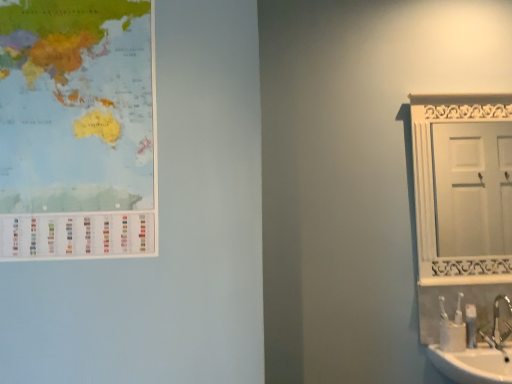
Question: Is matte paper map at upper left wider than white wooden door at right?

Choices:
 (A) no
 (B) yes

Answer: (A)

Question: Is the position of matte paper map at upper left less distant than that of white wooden door at right?

Choices:
 (A) no
 (B) yes

Answer: (B)

Question: From a real-world perspective, is matte paper map at upper left beneath white wooden door at right?

Choices:
 (A) yes
 (B) no

Answer: (B)

Question: Considering the relative sizes of matte paper map at upper left and white wooden door at right in the image provided, is matte paper map at upper left smaller than white wooden door at right?

Choices:
 (A) no
 (B) yes

Answer: (B)

Question: From the image's perspective, would you say matte paper map at upper left is shown under white wooden door at right?

Choices:
 (A) no
 (B) yes

Answer: (A)

Question: Is white wooden door at right at the back of matte paper map at upper left?

Choices:
 (A) yes
 (B) no

Answer: (B)

Question: Does silver metallic faucet at lower right have a greater width compared to white wooden door at right?

Choices:
 (A) no
 (B) yes

Answer: (B)

Question: Is silver metallic faucet at lower right turned away from white wooden door at right?

Choices:
 (A) no
 (B) yes

Answer: (A)

Question: Is silver metallic faucet at lower right in front of white wooden door at right?

Choices:
 (A) yes
 (B) no

Answer: (A)

Question: From the image's perspective, does silver metallic faucet at lower right appear lower than white wooden door at right?

Choices:
 (A) no
 (B) yes

Answer: (B)

Question: Is silver metallic faucet at lower right touching white wooden door at right?

Choices:
 (A) no
 (B) yes

Answer: (A)

Question: From the image's perspective, would you say silver metallic faucet at lower right is positioned over white wooden door at right?

Choices:
 (A) yes
 (B) no

Answer: (B)

Question: Can you confirm if white plastic toothbrush at lower right is wider than white wooden door at right?

Choices:
 (A) no
 (B) yes

Answer: (B)